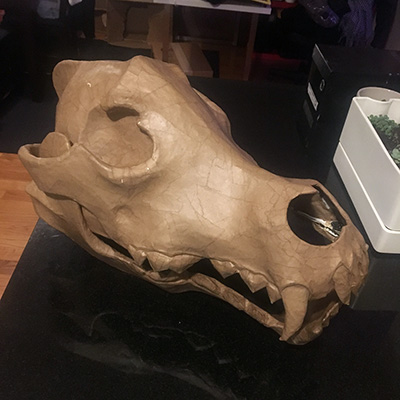
Locate an element on the screen. wood floor is located at coordinates (11, 221).